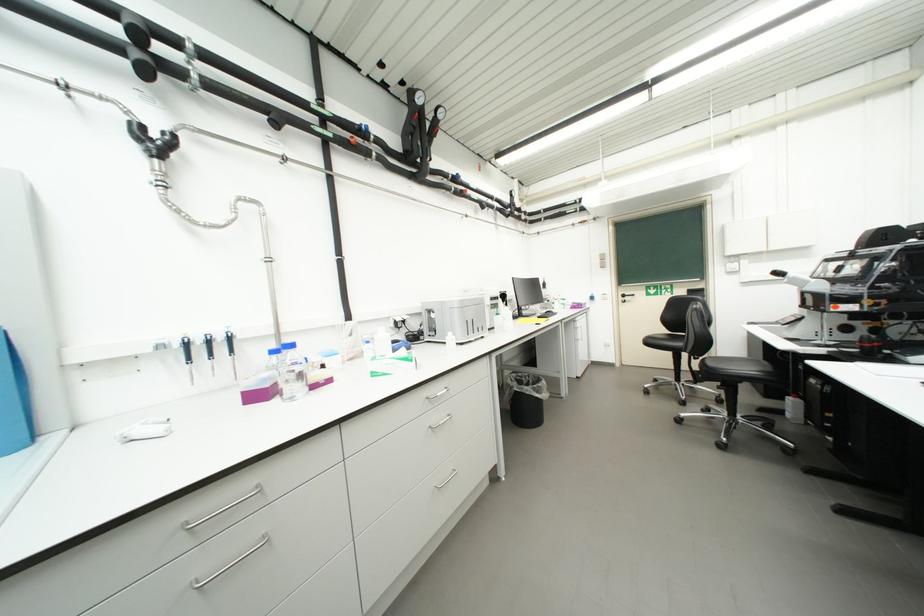
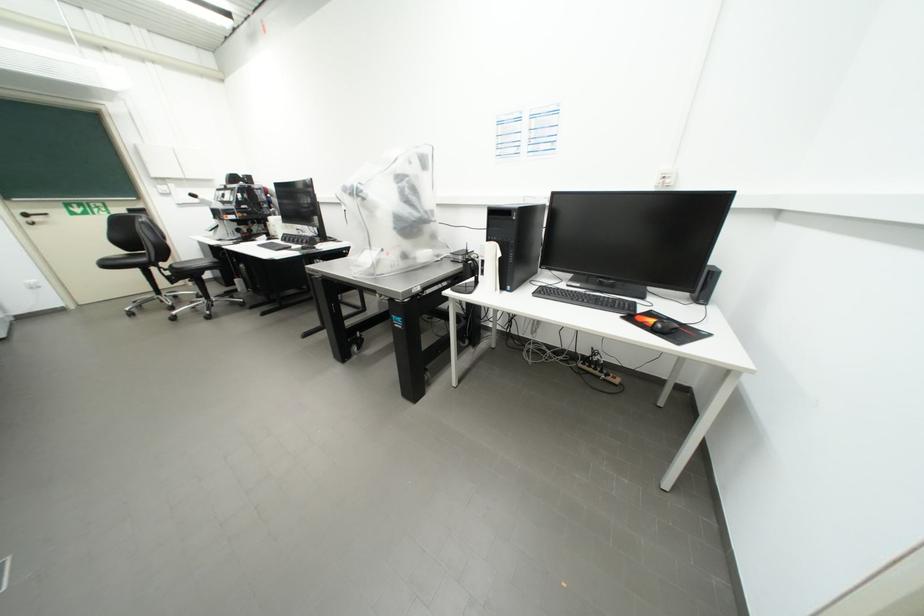
Where in the second image is the point corresponding to pixel 635 300 from the first image?

(43, 220)